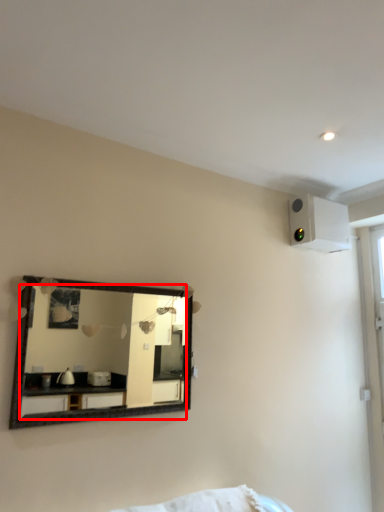
Question: Considering the relative positions of mirror (annotated by the red box) and air conditioning in the image provided, where is mirror (annotated by the red box) located with respect to the staircase?

Choices:
 (A) left
 (B) right

Answer: (A)